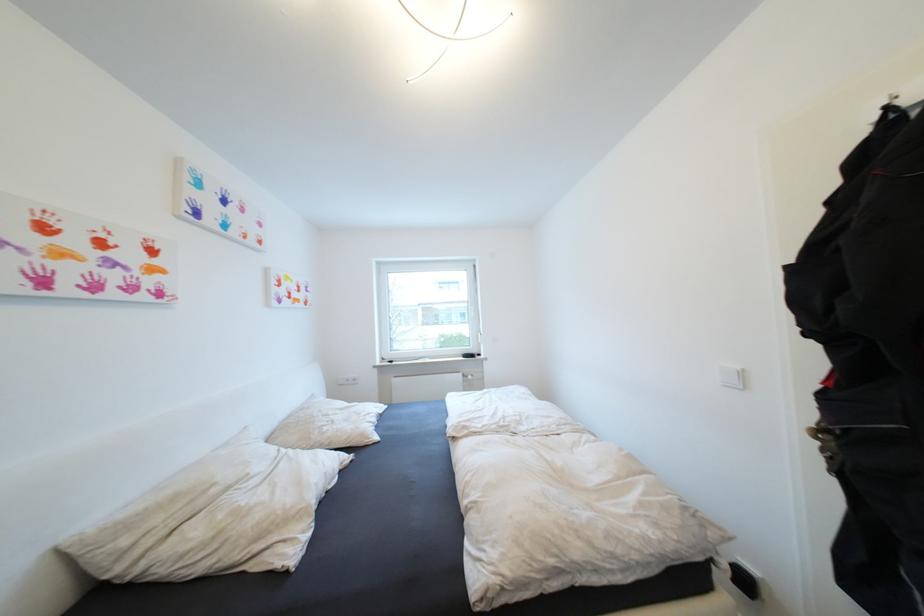
What do you see at coordinates (732, 377) in the screenshot? I see `a white light switch` at bounding box center [732, 377].